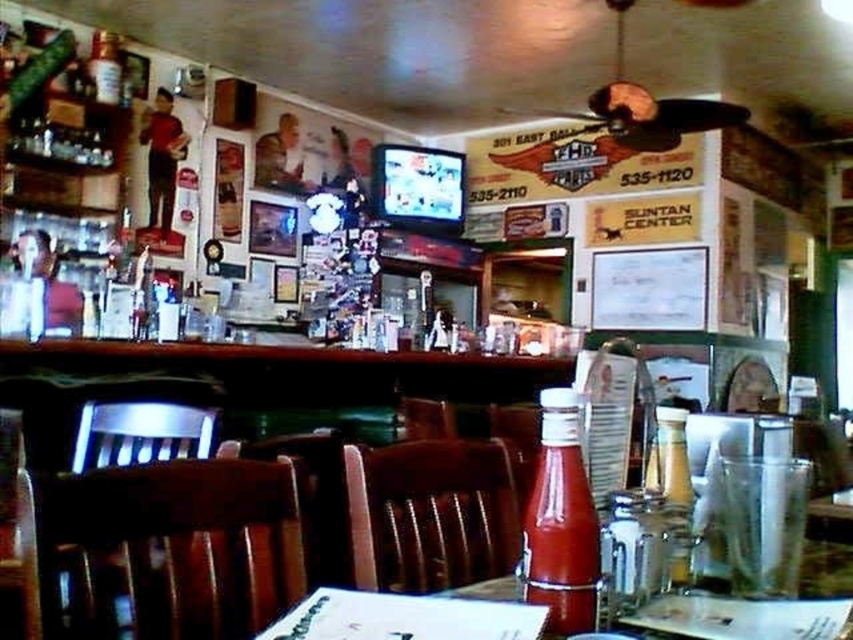
Is point (576, 600) positioned before point (810, 572)?

Yes, it is in front of point (810, 572).

Where is `matte glass bottle at center`? This screenshot has height=640, width=853. matte glass bottle at center is located at coordinates (560, 522).

You are a GUI agent. You are given a task and a screenshot of the screen. Output one action in this format:
    pyautogui.click(x=<x>, y=<y>)
    Task: Click on the brown leather chair at center
    This screenshot has width=853, height=640.
    Given the screenshot: What is the action you would take?
    pyautogui.click(x=430, y=513)

Who is more distant from viewer, (x=471, y=566) or (x=466, y=588)?

Point (x=471, y=566)

Locate an element on the screen. brown leather chair at center is located at coordinates (430, 513).

Is brown wood chair at lower left closer to camera compared to glassy plastic ketchup bottle at center?

Yes.

Which is above, brown wood chair at lower left or glassy plastic ketchup bottle at center?

brown wood chair at lower left

The height and width of the screenshot is (640, 853). Find the location of `brown wood chair at lower left`. brown wood chair at lower left is located at coordinates (192, 540).